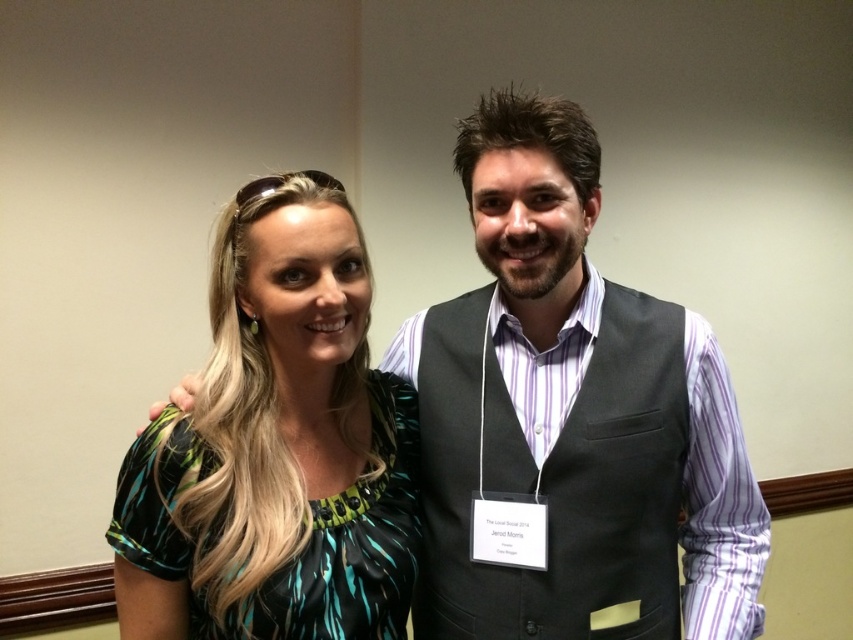
Question: Which point is closer to the camera?

Choices:
 (A) (466, 593)
 (B) (337, 612)

Answer: (B)

Question: Does matte black vest at center have a smaller size compared to green printed fabric dress at left?

Choices:
 (A) no
 (B) yes

Answer: (A)

Question: Can you confirm if matte black vest at center is bigger than green printed fabric dress at left?

Choices:
 (A) no
 (B) yes

Answer: (B)

Question: Which of the following is the farthest from the observer?

Choices:
 (A) green printed fabric dress at left
 (B) matte black vest at center

Answer: (B)

Question: Can you confirm if matte black vest at center is smaller than green printed fabric dress at left?

Choices:
 (A) no
 (B) yes

Answer: (A)

Question: Among these points, which one is farthest from the camera?

Choices:
 (A) (347, 541)
 (B) (519, 173)

Answer: (A)